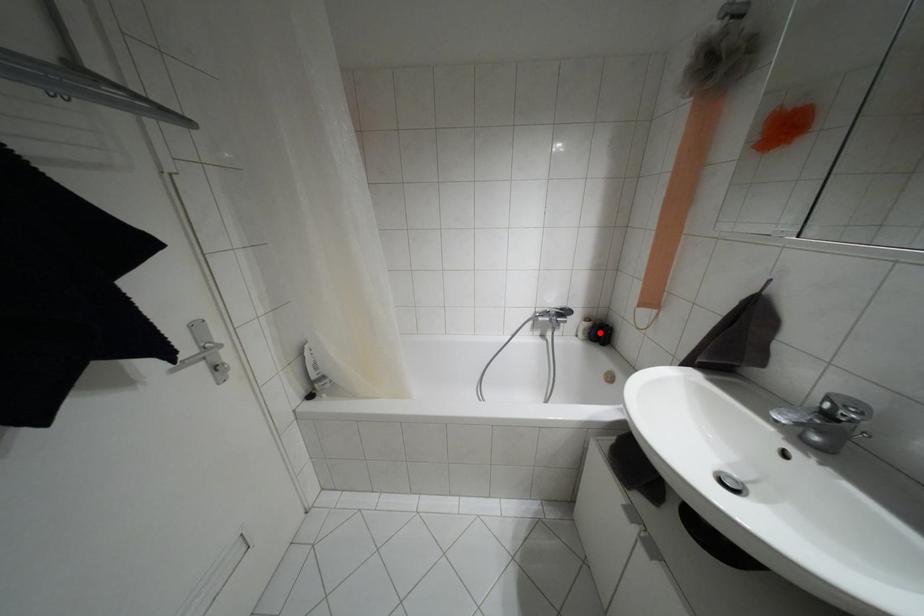
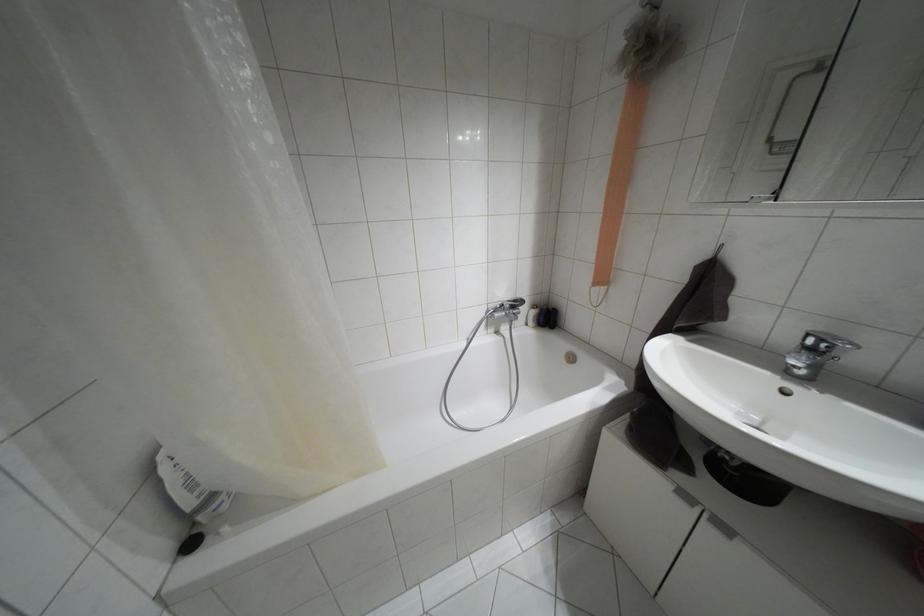
In the second image, find the point that corresponds to the highlighted location in the first image.

(546, 317)